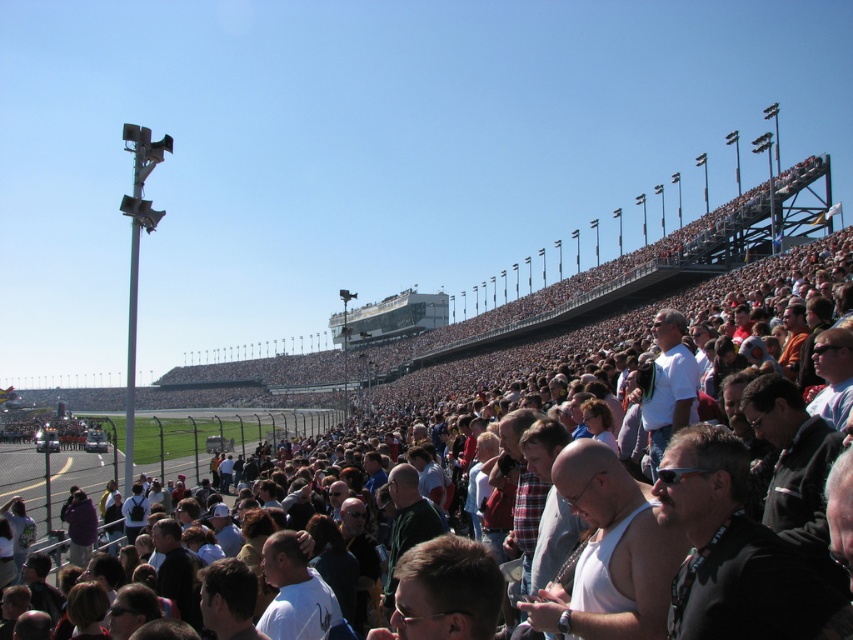
Measure the distance from white tank top at center to white matte shirt at center.

white tank top at center and white matte shirt at center are 74.68 feet apart.

Is white tank top at center smaller than white matte shirt at center?

Actually, white tank top at center might be larger than white matte shirt at center.

The height and width of the screenshot is (640, 853). I want to click on white tank top at center, so click(x=610, y=552).

In order to click on white tank top at center in this screenshot , I will do `click(610, 552)`.

Between white matte shirt at center and purple fabric jacket at lower left, which one appears on the right side from the viewer's perspective?

Positioned to the right is white matte shirt at center.

Is white matte shirt at center bigger than purple fabric jacket at lower left?

Correct, white matte shirt at center is larger in size than purple fabric jacket at lower left.

Which is in front, point (265, 628) or point (86, 541)?

Point (265, 628) is more forward.

This screenshot has height=640, width=853. Find the location of `white matte shirt at center`. white matte shirt at center is located at coordinates (297, 593).

Who is higher up, white tank top at center or purple fabric jacket at lower left?

Positioned higher is white tank top at center.

Who is shorter, white tank top at center or purple fabric jacket at lower left?

purple fabric jacket at lower left

What are the coordinates of `white tank top at center` in the screenshot? It's located at (610, 552).